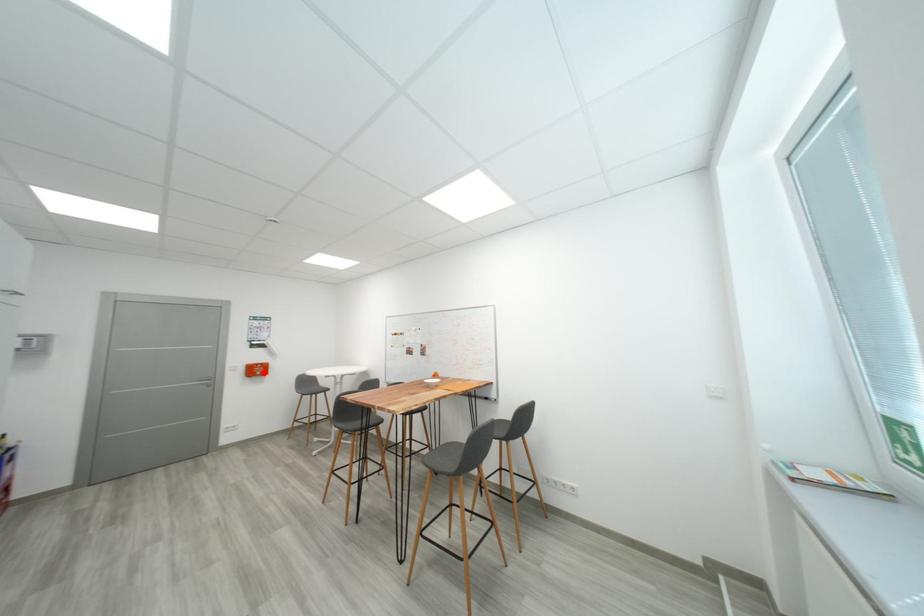
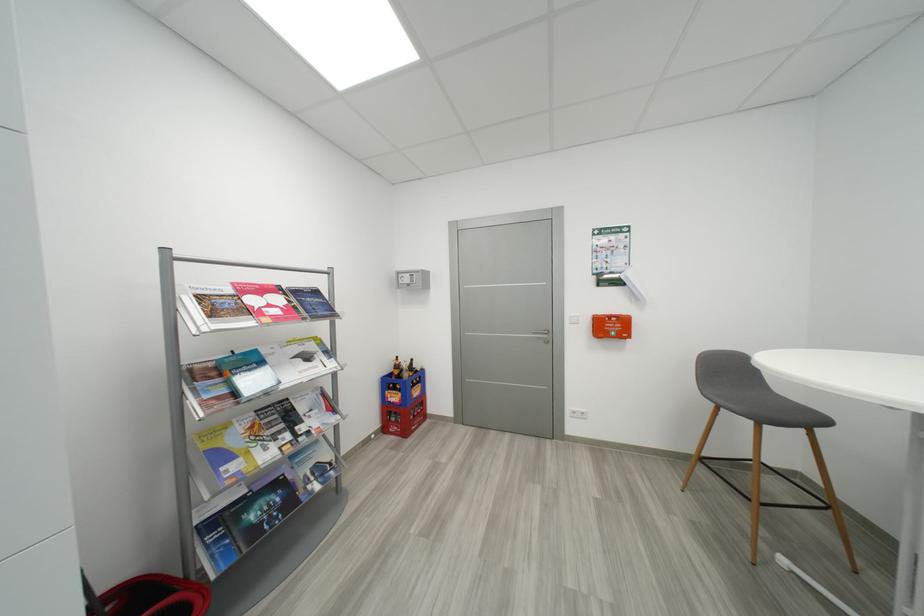
Question: I am providing you with two images of the same scene from different viewpoints. Image1 has a red point marked. In image2, the corresponding 3D location appears at what relative position? Reply with the corresponding letter.

Choices:
 (A) Closer
 (B) Farther

Answer: (A)